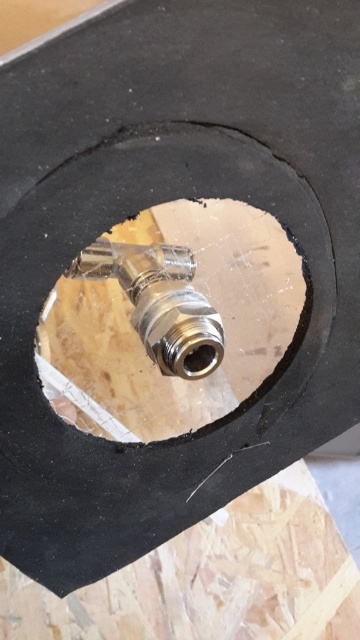
You are an engineer inspecting a plumbing system and see the metallic brass valve at center and the polished brass valve at center. Which valve is located to the right?

The metallic brass valve at center is positioned on the right side of the polished brass valve at center, so the metallic brass valve at center is the one located to the right.

You are an engineer inspecting the fitting. From your viewpoint, which of the two points, point (110, 333) or point (210, 323), is closer to the threaded end of the metallic fitting?

Point (210, 323) is closer to the threaded end of the metallic fitting because it is in front of point (110, 333).

You are an engineer installing a brass valve in a tight space. You have two options, the metallic brass valve at center and the polished brass valve at center. Which valve can you install without exceeding the 4.5 inch clearance requirement?

The distance between the metallic brass valve at center and the polished brass valve at center is 4.37 inches, so both valves can be installed within the 4.5 inch clearance requirement since 4.37 inches is less than 4.5 inches.